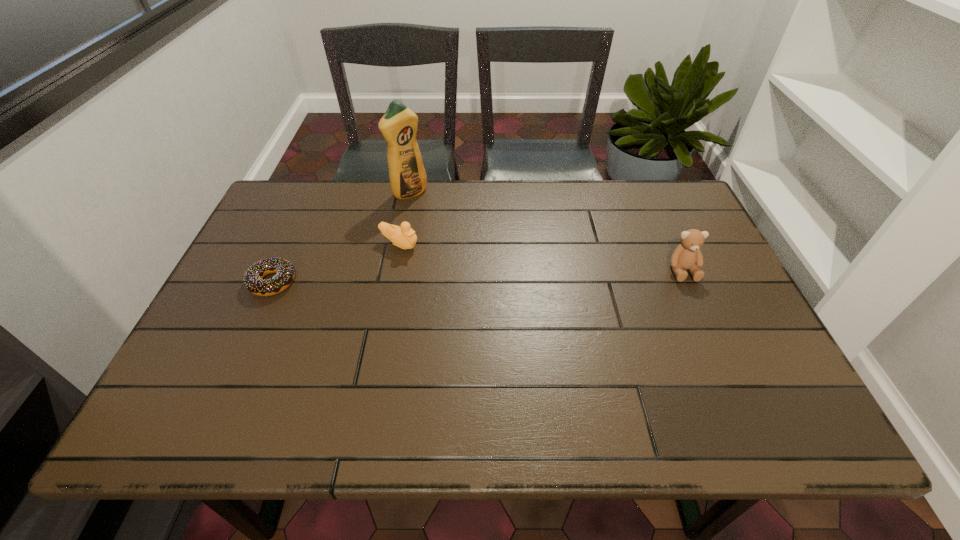
You are a GUI agent. You are given a task and a screenshot of the screen. Output one action in this format:
    pyautogui.click(x=<x>, y=<y>)
    Task: Click on the vacant position at the near edge of the desktop
    
    Given the screenshot: What is the action you would take?
    pyautogui.click(x=450, y=374)

I want to click on vacant space at the left edge of the desktop, so click(x=246, y=251).

Find the location of a particular element. The height and width of the screenshot is (540, 960). vacant space at the far left corner is located at coordinates (312, 180).

In the image, there is a desktop. Where is `vacant space at the near left corner`? vacant space at the near left corner is located at coordinates (205, 359).

In order to click on vacant space at the far right corner of the desktop in this screenshot , I will do `click(674, 183)`.

At what (x,y) coordinates should I click in order to perform the action: click on free space at the near right corner of the desktop. Please return your answer as a coordinate pair (x, y). The height and width of the screenshot is (540, 960). Looking at the image, I should click on (734, 363).

Where is `vacant area that lies between the third nearest object and the leftmost object`? The image size is (960, 540). vacant area that lies between the third nearest object and the leftmost object is located at coordinates (336, 264).

Where is `free space that is in between the doughnut and the tallest object`? Image resolution: width=960 pixels, height=540 pixels. free space that is in between the doughnut and the tallest object is located at coordinates (341, 238).

Identify the location of unoccupied area between the detergent and the duckling. (x=404, y=219).

Identify the location of free space between the tallest object and the duckling. (404, 219).